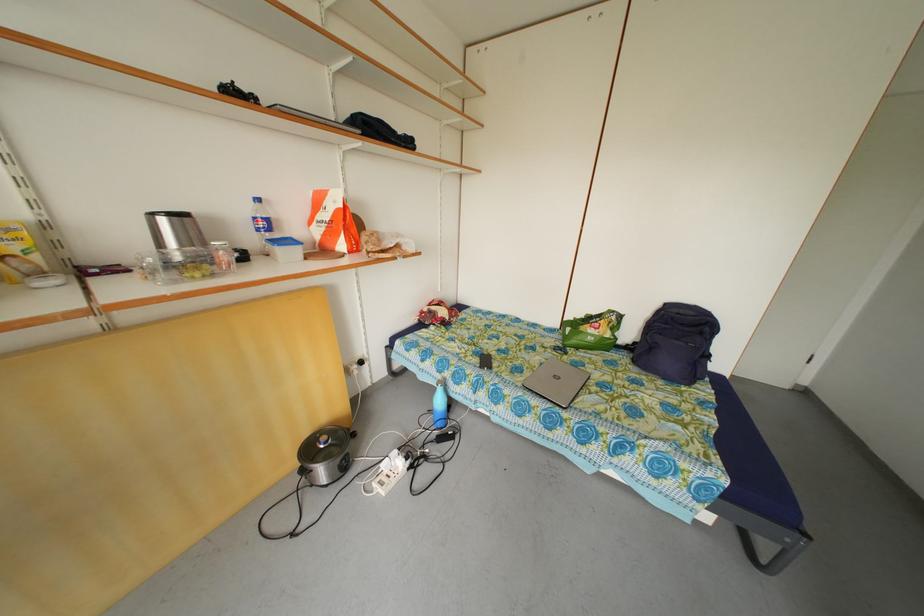
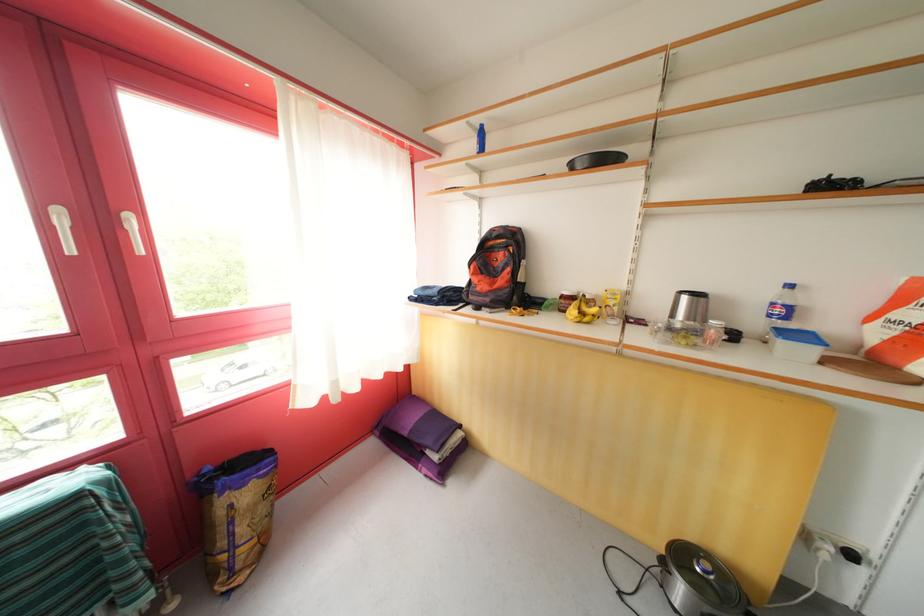
Question: The camera is either moving clockwise (left) or counter-clockwise (right) around the object. The first image is from the beginning of the video and the second image is from the end. Is the camera moving left or right when shooting the video?

Choices:
 (A) Left
 (B) Right

Answer: (B)